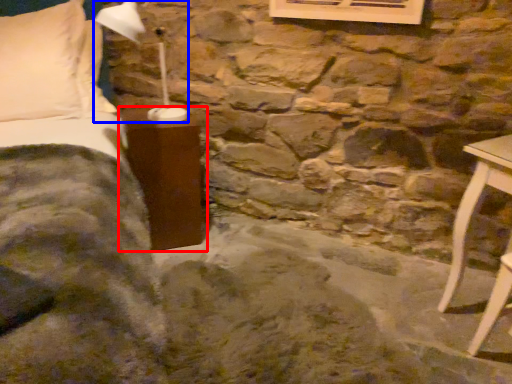
Question: Which of the following is the closest to the observer, furniture (highlighted by a red box) or table lamp (highlighted by a blue box)?

Choices:
 (A) furniture
 (B) table lamp

Answer: (B)